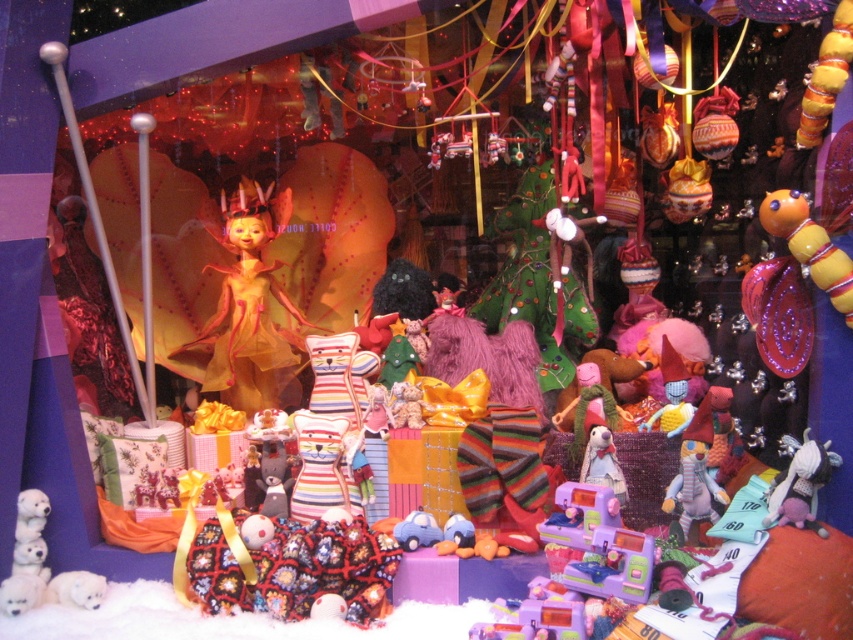
Question: Is shiny yellow caterpillar at center to the left of striped fabric teddy bear at center from the viewer's perspective?

Choices:
 (A) yes
 (B) no

Answer: (B)

Question: Does shiny yellow caterpillar at center appear under striped fabric teddy bear at center?

Choices:
 (A) yes
 (B) no

Answer: (B)

Question: Which of these objects is positioned closest to the shiny yellow caterpillar at center?

Choices:
 (A) white plush dog at lower left
 (B) velvet plush toy at lower right
 (C) striped woolen hat at center

Answer: (B)

Question: Which object is the closest to the striped woolen hat at center?

Choices:
 (A) white plush dog at lower left
 (B) velvet plush toy at lower right

Answer: (B)

Question: Which of the following is the farthest from the observer?

Choices:
 (A) (234, 304)
 (B) (830, 246)
 (C) (608, 432)

Answer: (A)

Question: Is matte orange fabric doll at center positioned before striped woolen hat at center?

Choices:
 (A) no
 (B) yes

Answer: (A)